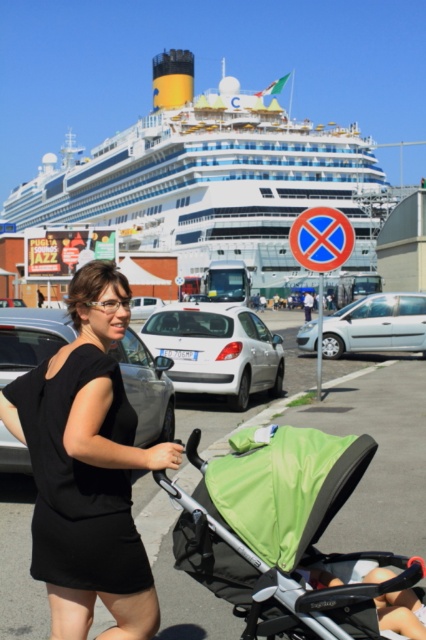
Question: Which object appears closest to the camera in this image?

Choices:
 (A) green fabric stroller at center
 (B) white matte hatchback at center
 (C) green fabric stroller at lower center

Answer: (C)

Question: Which object is closer to the camera taking this photo?

Choices:
 (A) black fabric dress at center
 (B) white matte hatchback at center

Answer: (A)

Question: Does white glossy cruise ship at upper center have a smaller size compared to black fabric dress at center?

Choices:
 (A) no
 (B) yes

Answer: (A)

Question: Is green fabric stroller at lower center positioned behind metallic silver car at center?

Choices:
 (A) no
 (B) yes

Answer: (A)

Question: Which object is farther from the camera taking this photo?

Choices:
 (A) soft fabric baby carriage at center
 (B) white matte car at center
 (C) black fabric dress at center

Answer: (B)

Question: Does white glossy cruise ship at upper center have a smaller size compared to soft fabric baby carriage at center?

Choices:
 (A) no
 (B) yes

Answer: (A)